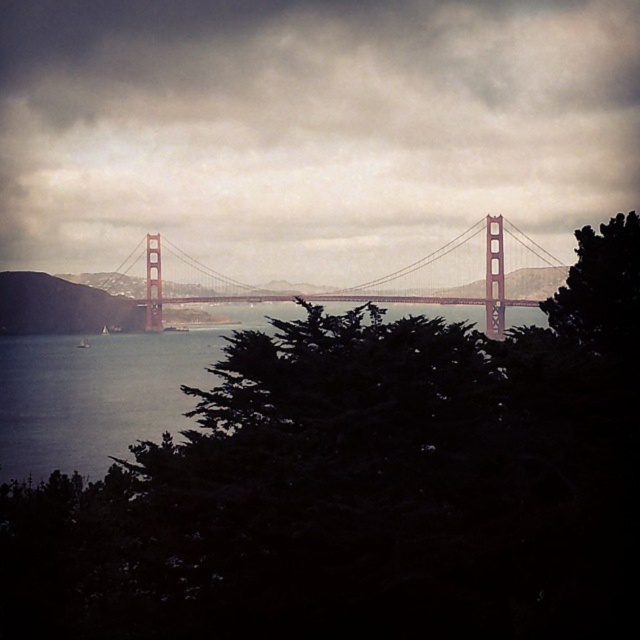
You are a photographer planning to take a picture of the metallic red bridge at center. However, you notice the green leafy tree at center is blocking part of the bridge. Can you determine if the tree is closer to you than the bridge?

The green leafy tree at center is closer to the viewer than the metallic red bridge at center, so yes, the tree is blocking part of the bridge because it is closer to you.

You are a photographer planning to capture the Golden Gate Bridge from this viewpoint. You notice the green leafy tree at center and the metallic red bridge at center. Which object is closer to the camera based on their positions?

The green leafy tree at center is positioned under the metallic red bridge at center, meaning it is closer to the camera.